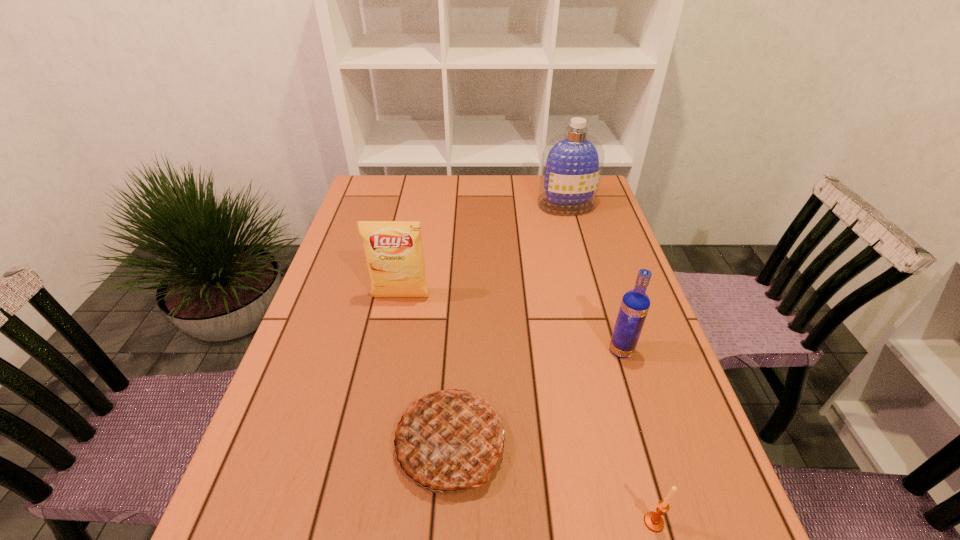
The height and width of the screenshot is (540, 960). In order to click on the tallest object in this screenshot , I will do `click(572, 162)`.

At what (x,y) coordinates should I click in order to perform the action: click on cleansing agent. Please return your answer as a coordinate pair (x, y). The width and height of the screenshot is (960, 540). Looking at the image, I should click on (572, 162).

Image resolution: width=960 pixels, height=540 pixels. What are the coordinates of `the fourth nearest object` in the screenshot? It's located at coord(394,253).

Identify the location of vodka. This screenshot has width=960, height=540. (635, 304).

Find the location of a particular element. pie is located at coordinates (449, 440).

This screenshot has width=960, height=540. What are the coordinates of `the second shortest object` in the screenshot? It's located at click(449, 440).

Find the location of a particular element. candle_holder is located at coordinates (654, 522).

The image size is (960, 540). I want to click on the nearest object, so click(654, 522).

This screenshot has width=960, height=540. Find the location of `free space located on the front of the farthest object`. free space located on the front of the farthest object is located at coordinates (576, 241).

In order to click on free space located on the front of the crisp (potato chip) with the logo in this screenshot , I will do `click(392, 343)`.